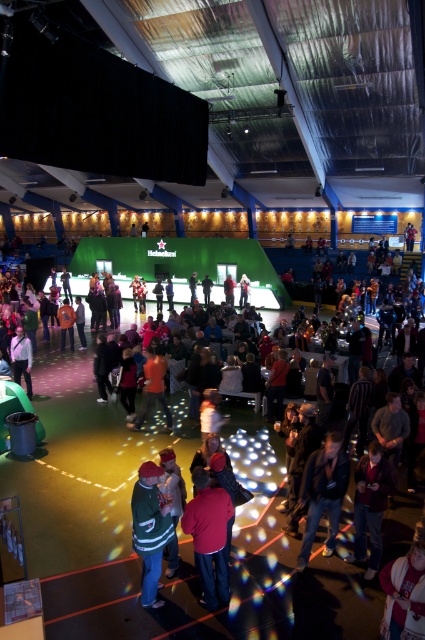
Is red fabric jacket at center bigger than white fleece jacket at lower right?

Yes, red fabric jacket at center is bigger than white fleece jacket at lower right.

Who is more distant from viewer, (212, 513) or (393, 588)?

The point (212, 513) is more distant.

Where is `red fabric jacket at center`? The image size is (425, 640). red fabric jacket at center is located at coordinates (209, 538).

Where is `red fabric jacket at center`? This screenshot has height=640, width=425. red fabric jacket at center is located at coordinates (209, 538).

Is green jersey at center to the right of red fabric jacket at center from the viewer's perspective?

No, green jersey at center is not to the right of red fabric jacket at center.

Which is below, green jersey at center or red fabric jacket at center?

red fabric jacket at center is lower down.

The height and width of the screenshot is (640, 425). Describe the element at coordinates (176, 528) in the screenshot. I see `green jersey at center` at that location.

At what (x,y) coordinates should I click in order to perform the action: click on green jersey at center. Please return your answer as a coordinate pair (x, y). The height and width of the screenshot is (640, 425). Looking at the image, I should click on (176, 528).

Who is more distant from viewer, (203,563) or (153,579)?

Point (153,579)

Which is in front, point (223, 540) or point (153, 486)?

Point (153, 486)

Between point (201, 529) and point (141, 531), which one is positioned in front?

Point (141, 531)

Where is `red fabric jacket at center`? red fabric jacket at center is located at coordinates tap(209, 538).